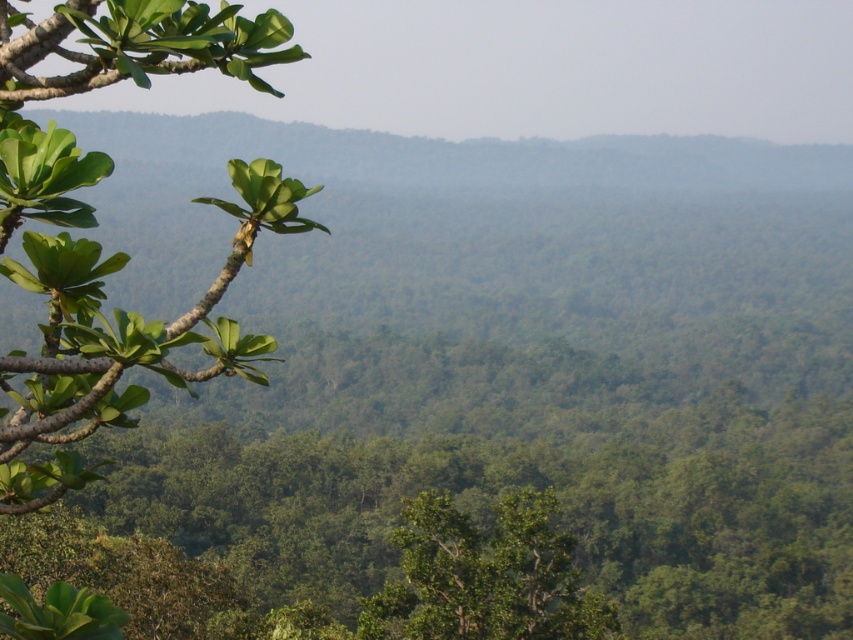
From the picture: Is green matte leafy branch at left below green leafy tree at center?

No, green matte leafy branch at left is not below green leafy tree at center.

Is point (225, 4) in front of point (440, 589)?

Yes, it is.

Is point (56, 88) positioned after point (503, 566)?

That is False.

Identify the location of green matte leafy branch at left. 117,339.